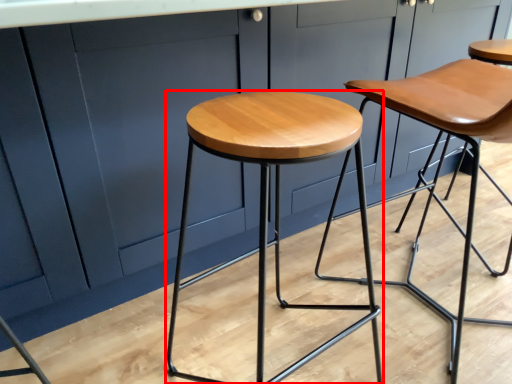
Question: From the image's perspective, where is stool (annotated by the red box) located in relation to stool in the image?

Choices:
 (A) below
 (B) above

Answer: (A)